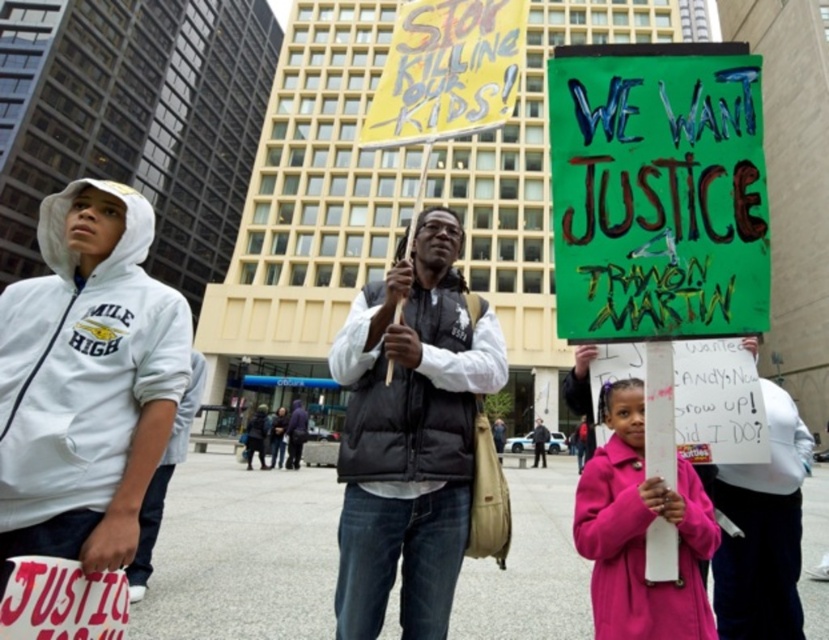
Consider the image. You are a photographer trying to capture a clear shot of both the green painted cardboard sign at center and the white fleece sweatshirt at left. Given that the camera frame can only accommodate objects of equal width, will you need to adjust the framing to include both?

The green painted cardboard sign at center has a smaller width than the white fleece sweatshirt at left. To include both in the camera frame, you would need to adjust the framing to account for their differing widths since the camera requires objects of equal width to fit.

You are a photographer trying to capture a closeup of the white fleece sweatshirt at left and the pink fabric coat at lower right. Which object should you zoom in on first to ensure both are in frame without moving the camera?

The white fleece sweatshirt at left is wider than the pink fabric coat at lower right, so you should zoom in on the white fleece sweatshirt at left first to ensure both fit in the frame.